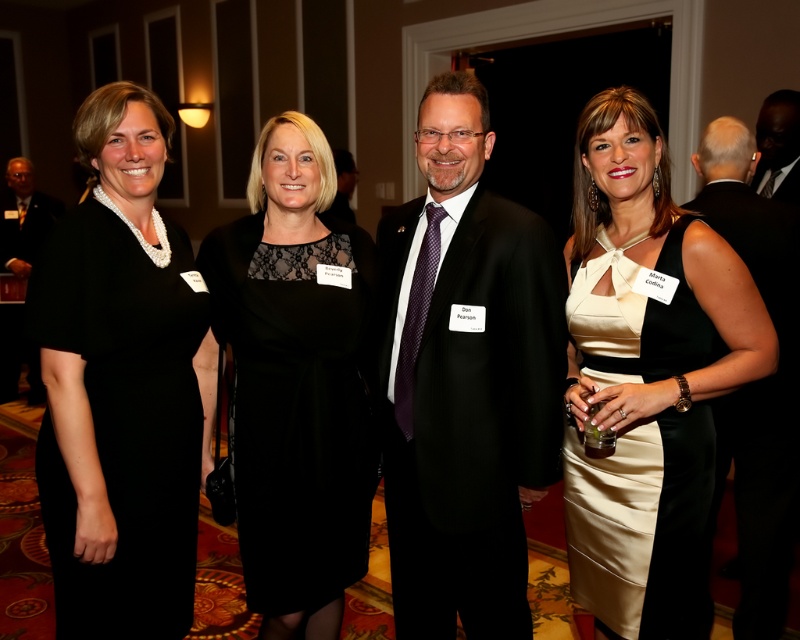
You are planning to place a 10 feet long banner between the matte black suit at center and the matte black suit at left. Will the banner fit without overlapping either suit?

The distance between the matte black suit at center and the matte black suit at left is 13.89 feet. Since the banner is 10 feet long, it will fit between them without overlapping as there is enough space.

Based on the photo, you are standing in the room and want to take a photo of the matte black suit at center. Where should you position yourself to ensure the suit is in the frame?

Position yourself facing the center of the room where the matte black suit at center is located at coordinates approximately 0.594 on the x and 0.583 on the y axis to capture it in the frame.

You are at a formal event and want to take a photo with the black satin dress at left and the matte black suit at upper right. To ensure both are visible in the frame, where should you position yourself relative to them?

Position yourself so that you are above the black satin dress at left and below the matte black suit at upper right to capture both in the frame since the black satin dress at left is located below the matte black suit at upper right.